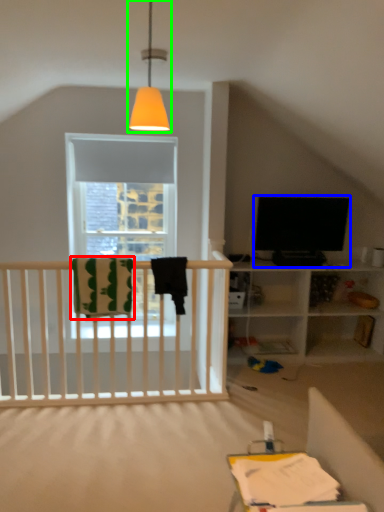
Question: Considering the real-world distances, which object is closest to blanket (highlighted by a red box)? television (highlighted by a blue box) or lamp (highlighted by a green box).

Choices:
 (A) television
 (B) lamp

Answer: (A)